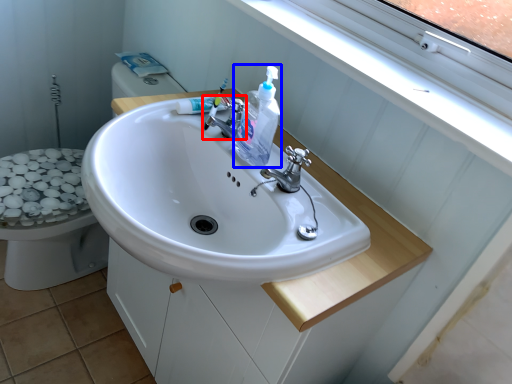
Question: Which object appears farthest to the camera in this image, tap (highlighted by a red box) or cleaning product (highlighted by a blue box)?

Choices:
 (A) tap
 (B) cleaning product

Answer: (A)